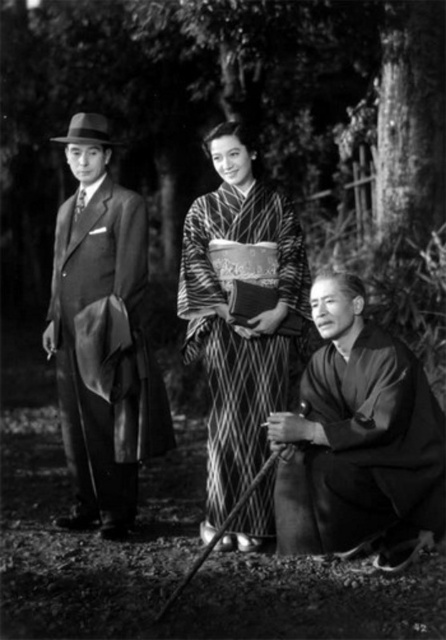
You are organizing a clothing donation drive and need to determine which item takes up more space in the donation box. Based on the image, which clothing item is larger in size between the smooth black suit at left and the silky kimono at lower right?

The smooth black suit at left has a larger size compared to the silky kimono at lower right, so it takes up more space in the donation box.